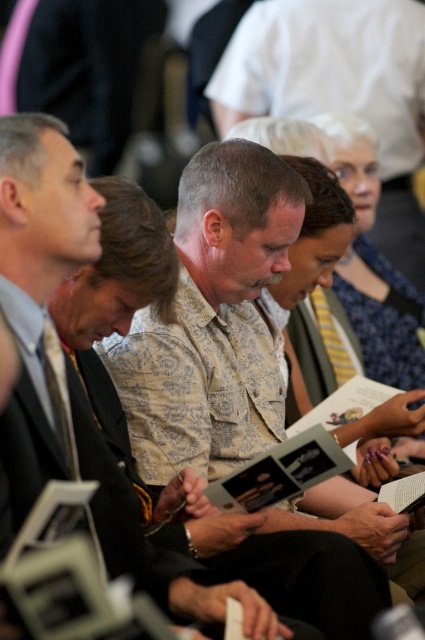
Question: From the image, what is the correct spatial relationship of patterned fabric shirt at center in relation to floral-patterned shirt at center?

Choices:
 (A) above
 (B) below

Answer: (A)

Question: Does patterned fabric shirt at center appear under floral-patterned shirt at center?

Choices:
 (A) yes
 (B) no

Answer: (B)

Question: Among these points, which one is nearest to the camera?

Choices:
 (A) (373, 541)
 (B) (36, 164)

Answer: (B)

Question: Observing the image, what is the correct spatial positioning of patterned fabric shirt at center in reference to floral-patterned shirt at center?

Choices:
 (A) below
 (B) above

Answer: (B)

Question: Which object is closer to the camera taking this photo?

Choices:
 (A) patterned fabric shirt at center
 (B) floral-patterned shirt at center

Answer: (B)